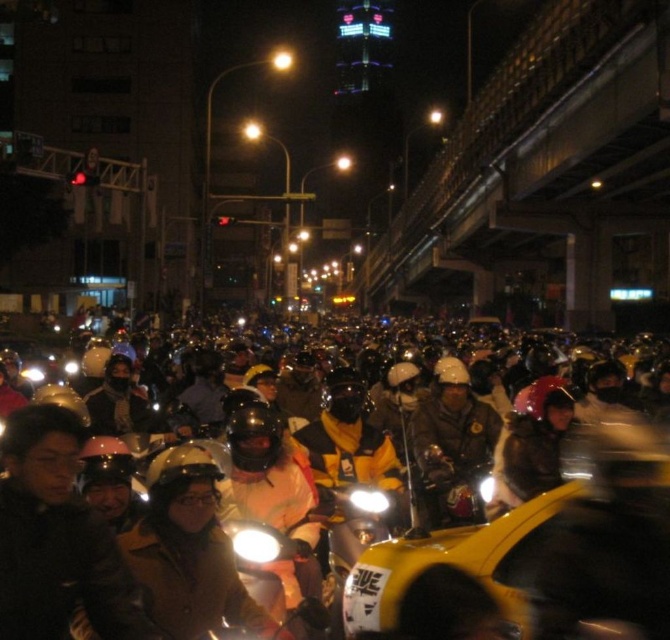
In the scene shown: Can you confirm if metallic silver motorcycle at center is taller than white glossy headlight at center?

Yes, metallic silver motorcycle at center is taller than white glossy headlight at center.

Can you confirm if metallic silver motorcycle at center is thinner than white glossy headlight at center?

In fact, metallic silver motorcycle at center might be wider than white glossy headlight at center.

Between point (436, 516) and point (263, 541), which one is positioned in front?

Positioned in front is point (263, 541).

This screenshot has width=670, height=640. Find the location of `metallic silver motorcycle at center`. metallic silver motorcycle at center is located at coordinates coord(450,486).

How distant is white glossy headlight at center from matte white headlight at center?

A distance of 2.47 meters exists between white glossy headlight at center and matte white headlight at center.

Is white glossy headlight at center further to the viewer compared to matte white headlight at center?

No, it is not.

Is point (247, 556) behind point (379, 497)?

No, (247, 556) is closer to viewer.

Image resolution: width=670 pixels, height=640 pixels. I want to click on white glossy headlight at center, so click(255, 545).

Which is more to the right, metallic silver motorcycle at center or matte white headlight at center?

From the viewer's perspective, metallic silver motorcycle at center appears more on the right side.

Can you confirm if metallic silver motorcycle at center is positioned to the right of matte white headlight at center?

Indeed, metallic silver motorcycle at center is positioned on the right side of matte white headlight at center.

Does point (442, 456) come behind point (358, 509)?

Yes, point (442, 456) is behind point (358, 509).

I want to click on metallic silver motorcycle at center, so click(450, 486).